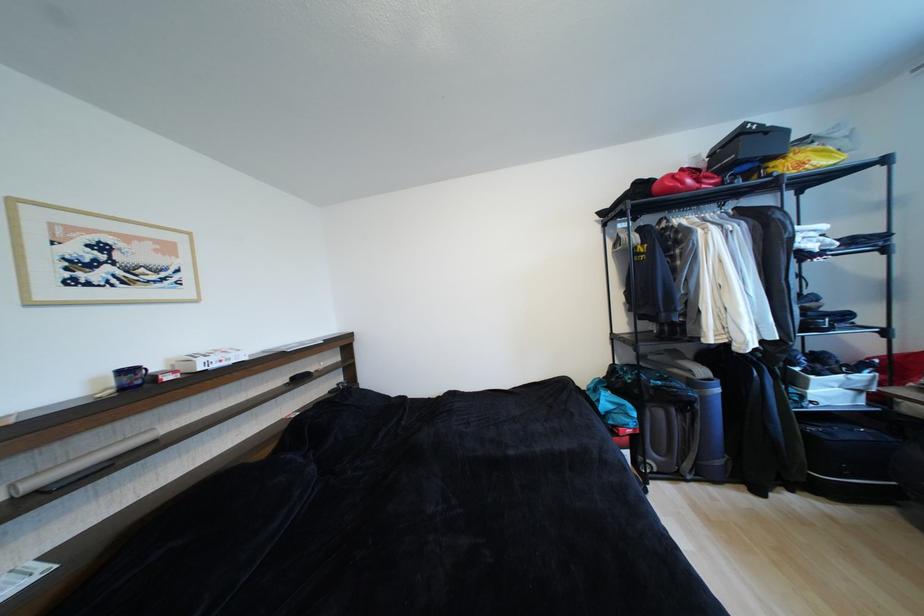
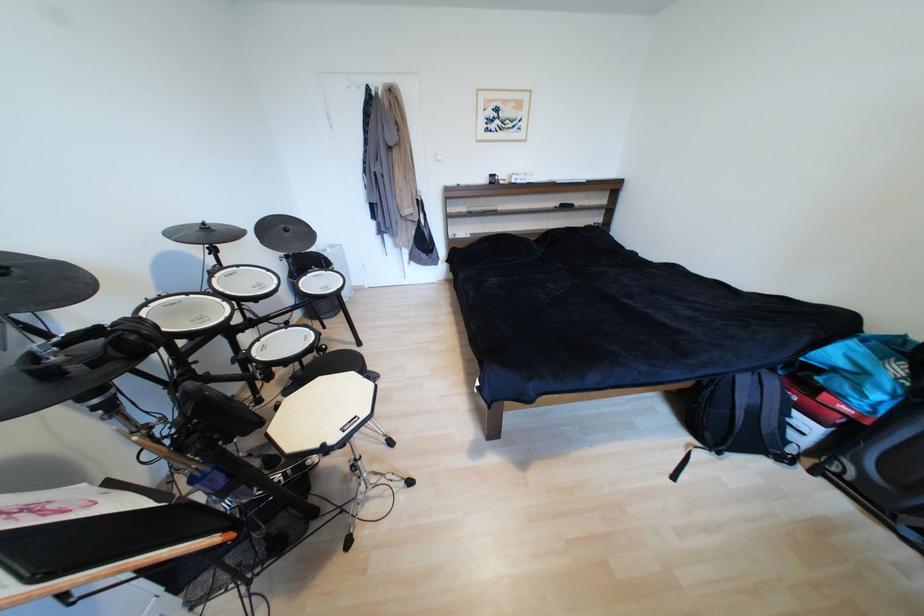
Where in the second image is the point corresponding to pixel 134 373 from the first image?

(499, 177)